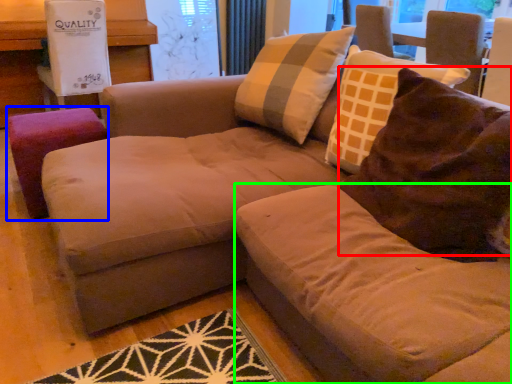
Question: Based on their relative distances, which object is nearer to throw pillow (highlighted by a red box)? Choose from stool (highlighted by a blue box) and beige (highlighted by a green box).

Choices:
 (A) stool
 (B) beige

Answer: (B)